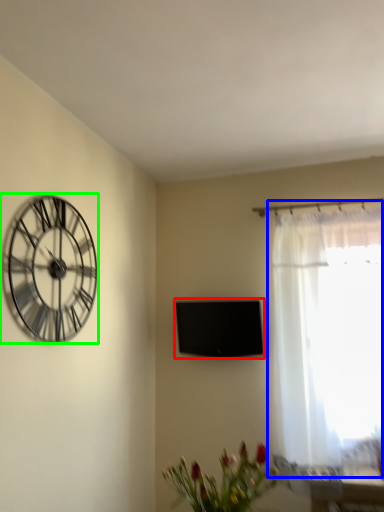
Question: Considering the real-world distances, which object is farthest from window screen (highlighted by a red box)? window (highlighted by a blue box) or wall clock (highlighted by a green box)?

Choices:
 (A) window
 (B) wall clock

Answer: (B)